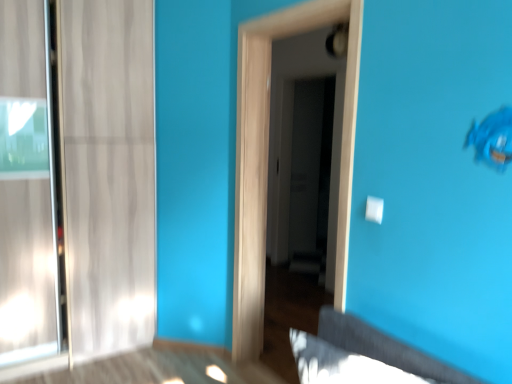
Question: Is transparent glass door at center, the second screen door positioned from the back, positioned in front of transparent glass door at center, positioned as the 2th screen door in front-to-back order?

Choices:
 (A) no
 (B) yes

Answer: (B)

Question: Considering the relative sizes of transparent glass door at center, which is the 1th screen door from front to back, and transparent glass door at center, which is counted as the 1th screen door, starting from the back, in the image provided, is transparent glass door at center, which is the 1th screen door from front to back, bigger than transparent glass door at center, which is counted as the 1th screen door, starting from the back,?

Choices:
 (A) yes
 (B) no

Answer: (A)

Question: From the image's perspective, is transparent glass door at center, the second screen door positioned from the back, on transparent glass door at center, positioned as the 2th screen door in front-to-back order?

Choices:
 (A) yes
 (B) no

Answer: (B)

Question: Is there a large distance between transparent glass door at center, the second screen door positioned from the back, and transparent glass door at center, which is counted as the 1th screen door, starting from the back?

Choices:
 (A) yes
 (B) no

Answer: (A)

Question: Can you confirm if transparent glass door at center, which is the 1th screen door from front to back, is smaller than transparent glass door at center, which is counted as the 1th screen door, starting from the back?

Choices:
 (A) no
 (B) yes

Answer: (A)

Question: Is transparent glass door at center, which is the 1th screen door from front to back, behind transparent glass door at center, positioned as the 2th screen door in front-to-back order?

Choices:
 (A) no
 (B) yes

Answer: (A)

Question: Is transparent glass door at center, positioned as the 2th screen door in front-to-back order, behind transparent glass door at center, which is the 1th screen door from front to back?

Choices:
 (A) no
 (B) yes

Answer: (B)

Question: Is transparent glass door at center, positioned as the 2th screen door in front-to-back order, oriented away from transparent glass door at center, the second screen door positioned from the back?

Choices:
 (A) no
 (B) yes

Answer: (A)

Question: Is transparent glass door at center, positioned as the 2th screen door in front-to-back order, not close to transparent glass door at center, the second screen door positioned from the back?

Choices:
 (A) no
 (B) yes

Answer: (B)

Question: Are transparent glass door at center, positioned as the 2th screen door in front-to-back order, and transparent glass door at center, which is the 1th screen door from front to back, making contact?

Choices:
 (A) no
 (B) yes

Answer: (A)

Question: From a real-world perspective, is transparent glass door at center, positioned as the 2th screen door in front-to-back order, located higher than transparent glass door at center, the second screen door positioned from the back?

Choices:
 (A) no
 (B) yes

Answer: (B)

Question: Does transparent glass door at center, which is counted as the 1th screen door, starting from the back, appear on the right side of transparent glass door at center, which is the 1th screen door from front to back?

Choices:
 (A) yes
 (B) no

Answer: (A)

Question: Considering their positions, is transparent glass door at center, which is the 1th screen door from front to back, located in front of or behind transparent glass door at center, positioned as the 2th screen door in front-to-back order?

Choices:
 (A) front
 (B) behind

Answer: (A)